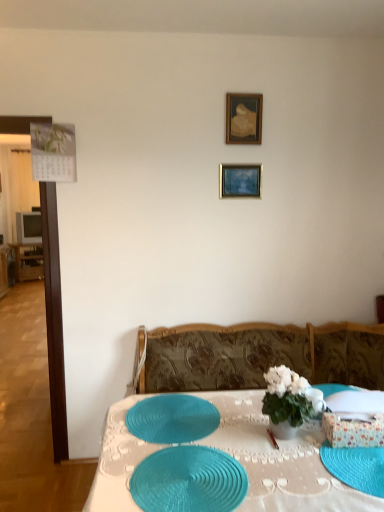
The image size is (384, 512). Find the location of `free space underneath teal woven placemat at center, positioned as the second tableware in back-to-front order (from a real-world perspective)`. free space underneath teal woven placemat at center, positioned as the second tableware in back-to-front order (from a real-world perspective) is located at coordinates (190, 487).